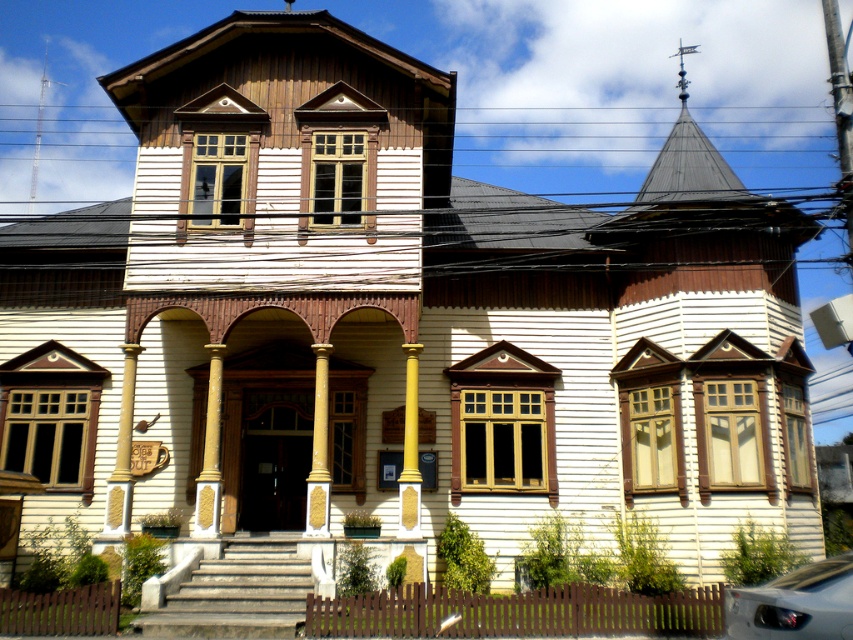
Who is more distant from viewer, (x=206, y=582) or (x=316, y=472)?

The point (x=316, y=472) is behind.

Is point (178, 616) positioned in front of point (318, 413)?

Yes.

You are a GUI agent. You are given a task and a screenshot of the screen. Output one action in this format:
    pyautogui.click(x=<x>, y=<y>)
    Task: Click on the stone steps at center
    Image resolution: width=853 pixels, height=640 pixels.
    Given the screenshot: What is the action you would take?
    pyautogui.click(x=238, y=593)

Image resolution: width=853 pixels, height=640 pixels. I want to click on stone steps at center, so click(x=238, y=593).

In the scene shown: Between stone steps at center and polished silver spire at upper center, which one is positioned higher?

Positioned higher is polished silver spire at upper center.

Is stone steps at center further to camera compared to polished silver spire at upper center?

No, stone steps at center is closer to the viewer.

The width and height of the screenshot is (853, 640). I want to click on stone steps at center, so click(x=238, y=593).

Is stone steps at center above smooth cream-colored column at center?

No.

Which is in front, point (270, 554) or point (122, 522)?

Point (270, 554) is in front.

Locate an element on the screen. stone steps at center is located at coordinates (238, 593).